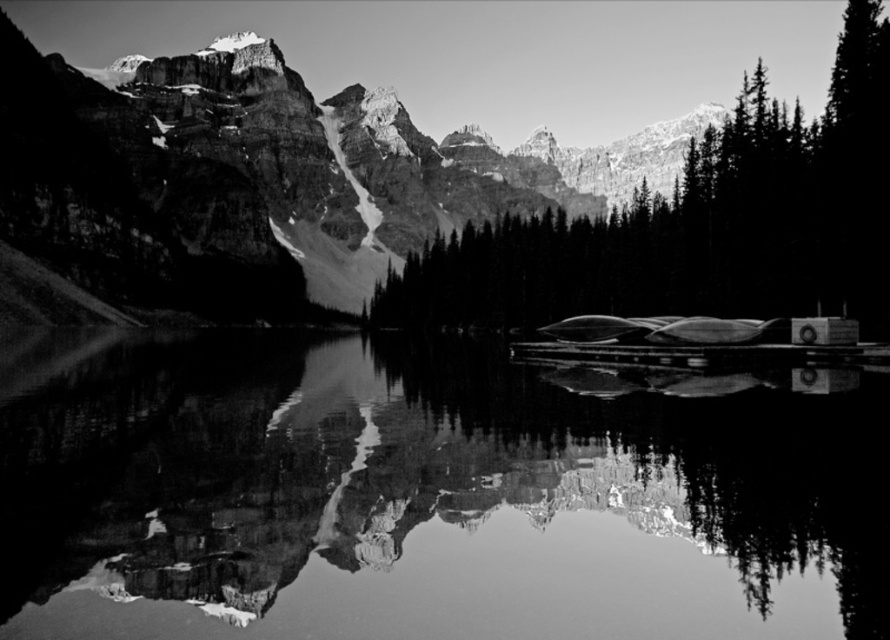
Question: Does smooth water at center have a smaller size compared to smooth dark green trees at center?

Choices:
 (A) no
 (B) yes

Answer: (B)

Question: Among these points, which one is nearest to the camera?

Choices:
 (A) (846, 72)
 (B) (207, 428)

Answer: (B)

Question: Can you confirm if smooth water at center is positioned below smooth dark green trees at center?

Choices:
 (A) yes
 (B) no

Answer: (A)

Question: Is smooth water at center bigger than smooth dark green trees at center?

Choices:
 (A) yes
 (B) no

Answer: (B)

Question: Which point is closer to the camera?

Choices:
 (A) smooth water at center
 (B) smooth dark green trees at center

Answer: (A)